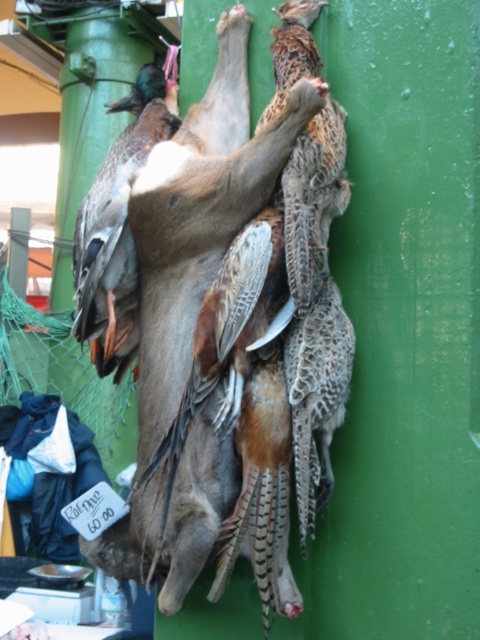
Question: Does feathered brown bird at center lie in front of green matte pillar at upper left?

Choices:
 (A) no
 (B) yes

Answer: (B)

Question: Which point is farther from the camera taking this photo?

Choices:
 (A) (120, 26)
 (B) (83, 323)
 (C) (300, 225)

Answer: (A)

Question: Which of the following is the closest to the observer?

Choices:
 (A) green matte pillar at upper left
 (B) feathered brown bird at center
 (C) shiny brown duck at left

Answer: (B)

Question: Does feathered brown bird at center appear on the left side of green matte pillar at upper left?

Choices:
 (A) yes
 (B) no

Answer: (B)

Question: Can you confirm if shiny brown duck at left is positioned to the right of feathered brown bird at center?

Choices:
 (A) no
 (B) yes

Answer: (A)

Question: Estimate the real-world distances between objects in this image. Which object is closer to the feathered brown bird at center?

Choices:
 (A) green matte pillar at upper left
 (B) shiny brown duck at left

Answer: (B)